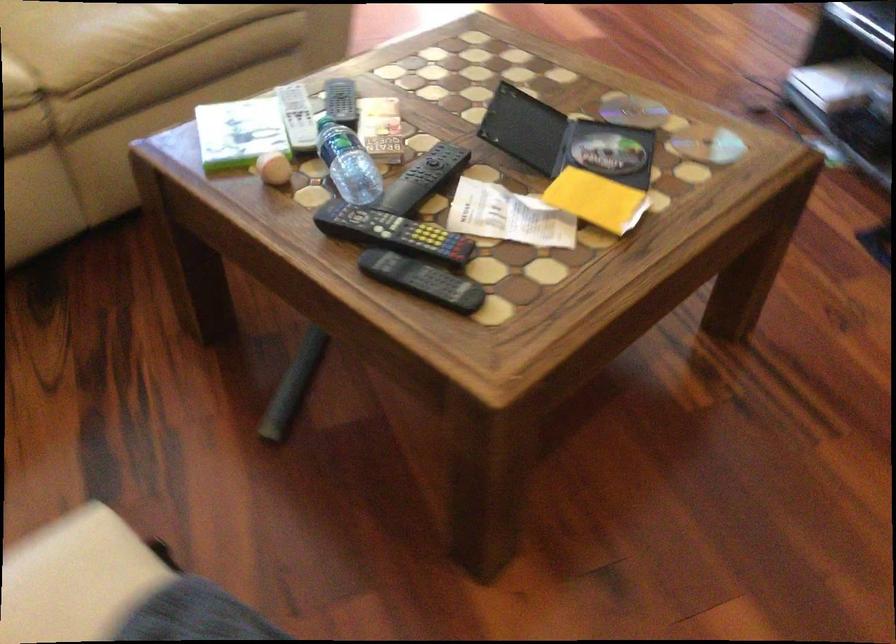
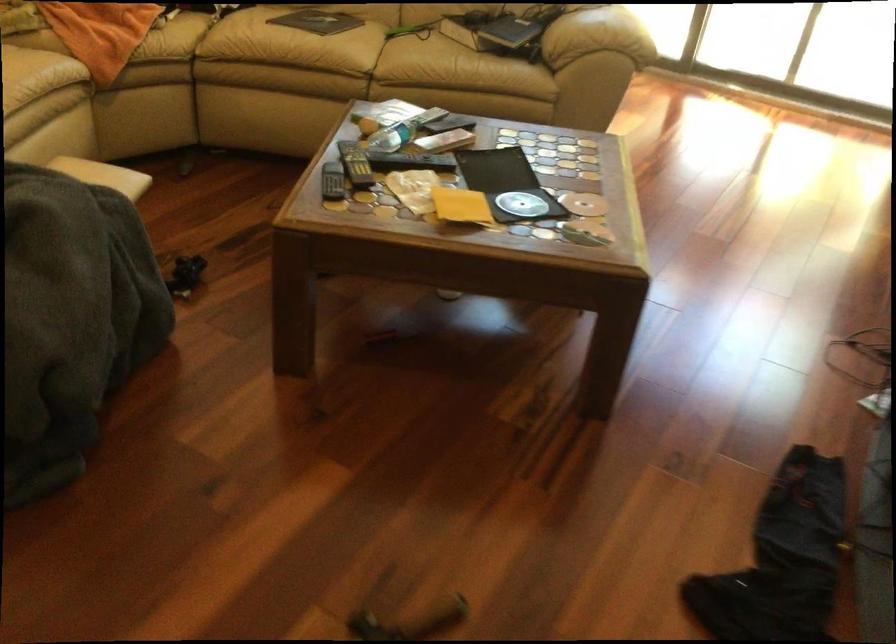
Find the pixel in the second image that matches pixel 444 277 in the first image.

(332, 182)